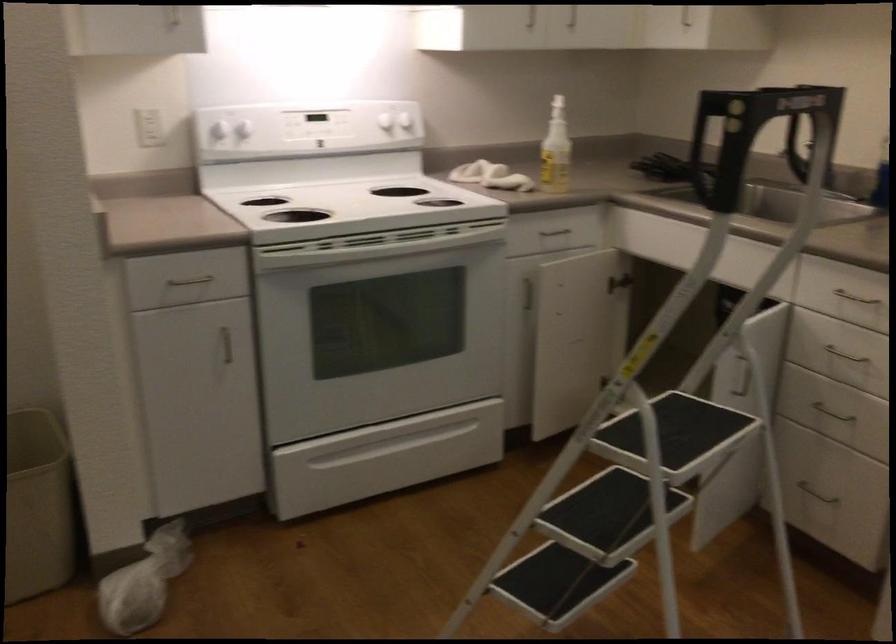
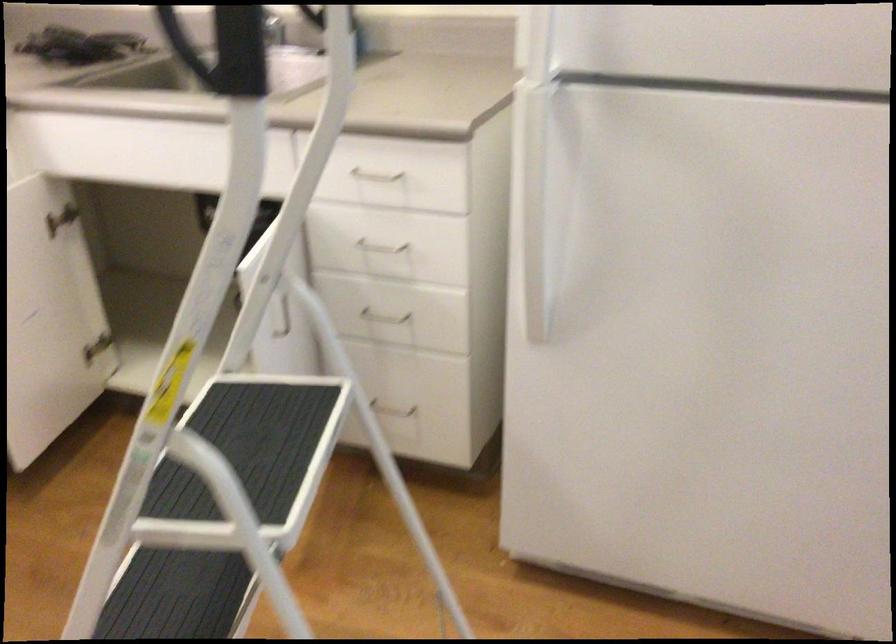
Question: I am providing you with two images of the same scene from different viewpoints. Which of the following objects are not visible in image2?

Choices:
 (A) black stepladder step
 (B) metal drawer handle
 (C) white refrigerator handle
 (D) none of these

Answer: (D)